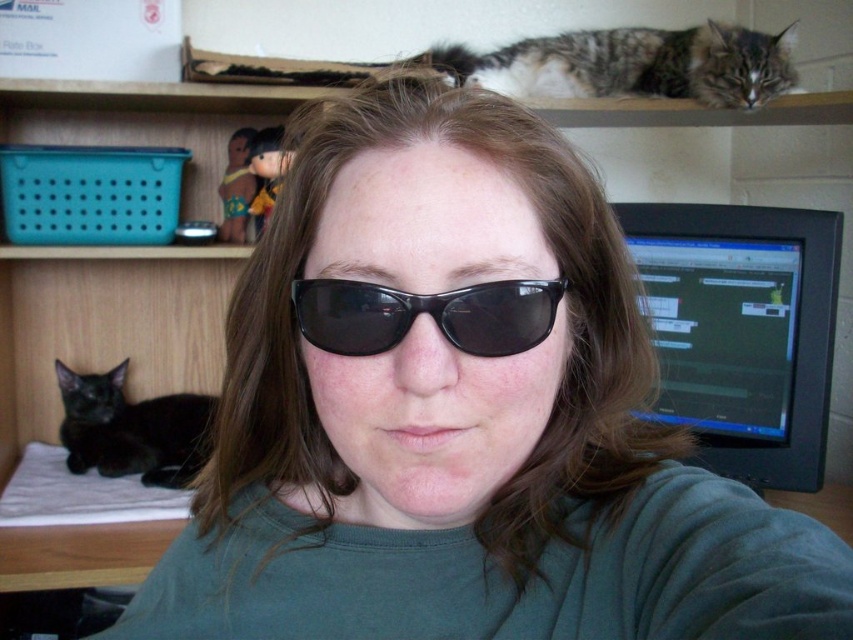
Question: Which point is farther to the camera?

Choices:
 (A) (479, 296)
 (B) (131, 448)
 (C) (701, 77)

Answer: (B)

Question: Is tabby fur cat at upper center to the right of black plastic sunglasses at center from the viewer's perspective?

Choices:
 (A) no
 (B) yes

Answer: (B)

Question: Which point is closer to the camera taking this photo?

Choices:
 (A) pos(782,316)
 (B) pos(654,90)
 (C) pos(173,464)

Answer: (A)

Question: Is black glossy monitor at right behind black fur cat at lower left?

Choices:
 (A) no
 (B) yes

Answer: (A)

Question: Which object is closer to the camera taking this photo?

Choices:
 (A) tabby fur cat at upper center
 (B) black glossy monitor at right
 (C) black fur cat at lower left
 (D) black plastic sunglasses at center

Answer: (D)

Question: Is black glossy monitor at right further to camera compared to tabby fur cat at upper center?

Choices:
 (A) yes
 (B) no

Answer: (B)